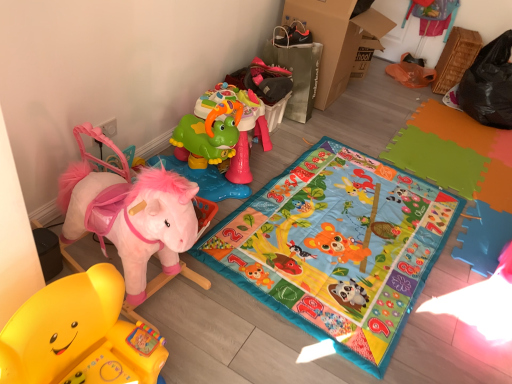
The width and height of the screenshot is (512, 384). I want to click on vacant region below green plastic toy at upper center, which is counted as the 1th toy, starting from the back (from a real-world perspective), so click(x=212, y=190).